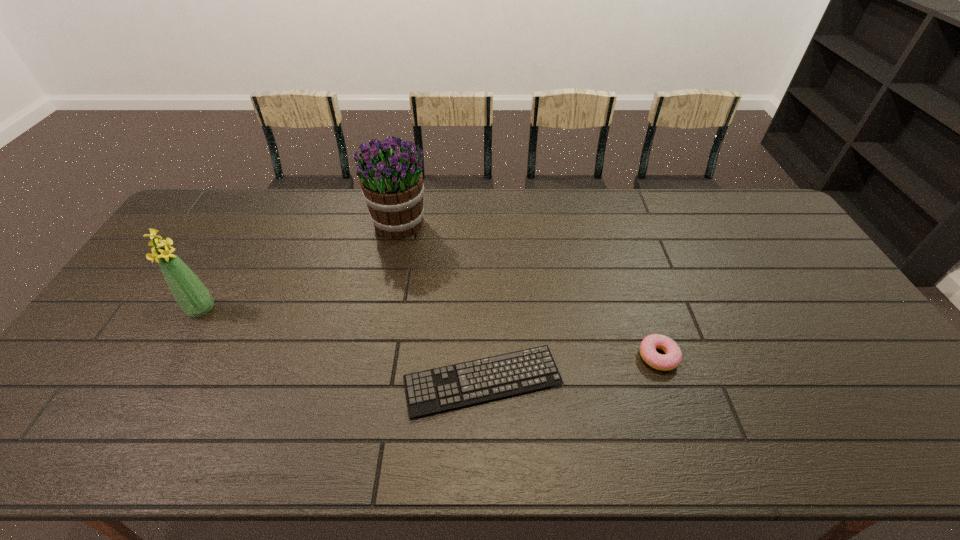
The height and width of the screenshot is (540, 960). Find the location of `vacant position located on the back of the shortest object`. vacant position located on the back of the shortest object is located at coordinates click(x=483, y=309).

Where is `object at the far edge`? object at the far edge is located at coordinates (390, 175).

In the image, there is a desktop. Where is `free space at the far edge`? This screenshot has width=960, height=540. free space at the far edge is located at coordinates (635, 193).

What are the coordinates of `vacant region at the near edge` in the screenshot? It's located at (802, 431).

Where is `free space at the left edge`? free space at the left edge is located at coordinates (190, 251).

Locate an element on the screen. The image size is (960, 540). vacant space at the right edge is located at coordinates (775, 242).

The height and width of the screenshot is (540, 960). I want to click on vacant space at the far right corner of the desktop, so click(x=756, y=210).

Where is `free space that is in between the shortest object and the farther bouquet`? free space that is in between the shortest object and the farther bouquet is located at coordinates (441, 302).

Where is `unoccupied area between the computer keyboard and the second farthest object`? unoccupied area between the computer keyboard and the second farthest object is located at coordinates (342, 345).

The height and width of the screenshot is (540, 960). Identify the location of free space that is in between the computer keyboard and the farther bouquet. (441, 302).